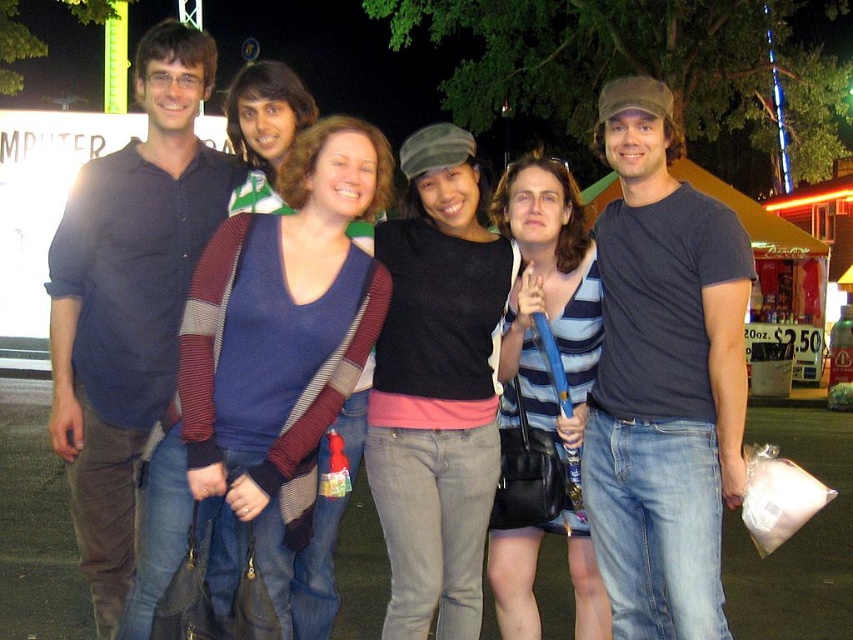
You are standing at the point labeled as point (418, 422) and want to walk towards the point labeled as point (630, 608). Which direction should you move?

You should move forward because point (630, 608) is in front of point (418, 422).

You are standing at point (482, 280) and want to walk to the food stand with the yellow roof. There is a point at (100, 419) that you can pass by. Based on the scene description, which point should you head towards first to reach the food stand?

You should head towards point (100, 419) first because it is in front of point (482, 280), meaning it is closer to the food stand in the background.